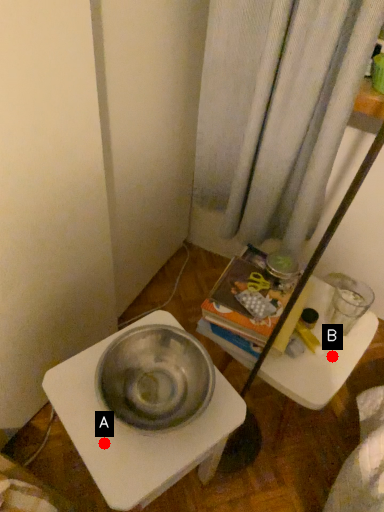
Question: Two points are circled on the image, labeled by A and B beside each circle. Which point appears farthest from the camera in this image?

Choices:
 (A) A is further
 (B) B is further

Answer: (B)